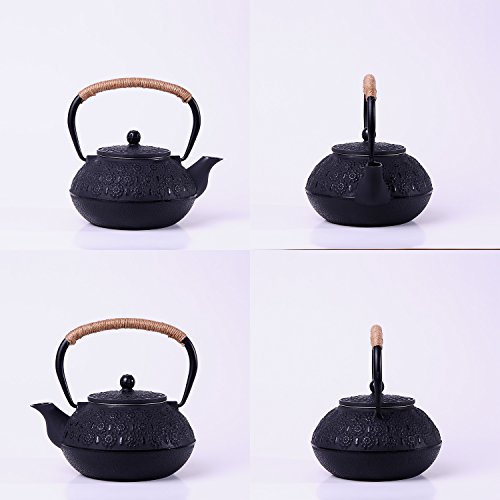
You are a GUI agent. You are given a task and a screenshot of the screen. Output one action in this format:
    pyautogui.click(x=<x>, y=<y>)
    Task: Click on the brown handle of tea kettle
    Image resolution: width=500 pixels, height=500 pixels.
    Given the screenshot: What is the action you would take?
    pyautogui.click(x=147, y=82)